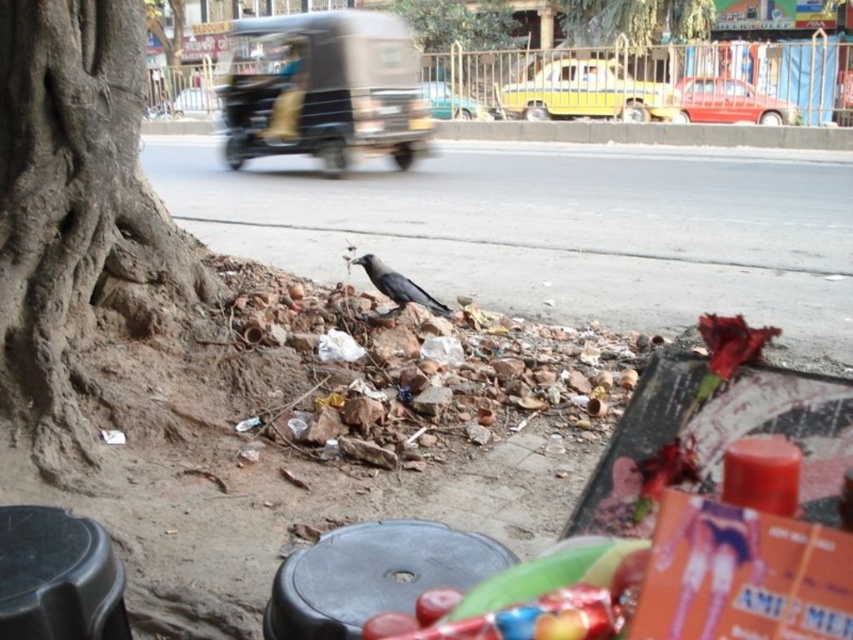
Which of these two, brown rough tree trunk at lower left or shiny black crow at center, stands taller?

brown rough tree trunk at lower left

Does point (28, 109) lie in front of point (386, 272)?

Yes, point (28, 109) is in front of point (386, 272).

You are a GUI agent. You are given a task and a screenshot of the screen. Output one action in this format:
    pyautogui.click(x=<x>, y=<y>)
    Task: Click on the brown rough tree trunk at lower left
    This screenshot has width=853, height=640.
    Given the screenshot: What is the action you would take?
    pyautogui.click(x=77, y=216)

Measure the distance from brown rough tree trunk at lower left to metallic silver car at center.

brown rough tree trunk at lower left and metallic silver car at center are 14.08 meters apart.

Does point (117, 6) lie behind point (456, 108)?

That is False.

Image resolution: width=853 pixels, height=640 pixels. In order to click on brown rough tree trunk at lower left in this screenshot , I will do `click(77, 216)`.

Locate an element on the screen. brown rough tree trunk at lower left is located at coordinates (77, 216).

Who is more forward, (53, 305) or (289, 138)?

Point (53, 305) is more forward.

Does brown rough tree trunk at lower left have a lesser height compared to metallic black auto-rickshaw at upper center?

No, brown rough tree trunk at lower left is not shorter than metallic black auto-rickshaw at upper center.

Is point (183, 282) positioned before point (345, 84)?

Yes, point (183, 282) is closer to viewer.

Identify the location of brown rough tree trunk at lower left. The image size is (853, 640). (77, 216).